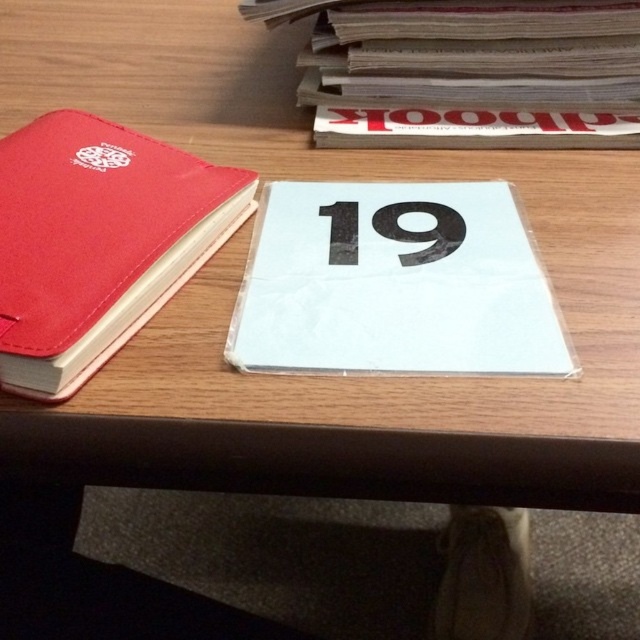
Question: Can you confirm if matte red notebook at left is thinner than gray paper book at upper right?

Choices:
 (A) no
 (B) yes

Answer: (B)

Question: Which object is positioned closest to the gray paper book at upper right?

Choices:
 (A) matte red notebook at left
 (B) white paper card at center
 (C) black paper at center

Answer: (B)

Question: Considering the relative positions of white paper card at center and black paper at center in the image provided, where is white paper card at center located with respect to black paper at center?

Choices:
 (A) below
 (B) above

Answer: (A)

Question: Which object is closer to the camera taking this photo?

Choices:
 (A) white paper card at center
 (B) black paper at center

Answer: (A)

Question: Which object is positioned farthest from the gray paper book at upper right?

Choices:
 (A) black paper at center
 (B) matte red notebook at left
 (C) white paper card at center

Answer: (B)

Question: Where is white paper card at center located in relation to gray paper book at upper right in the image?

Choices:
 (A) below
 (B) above

Answer: (A)